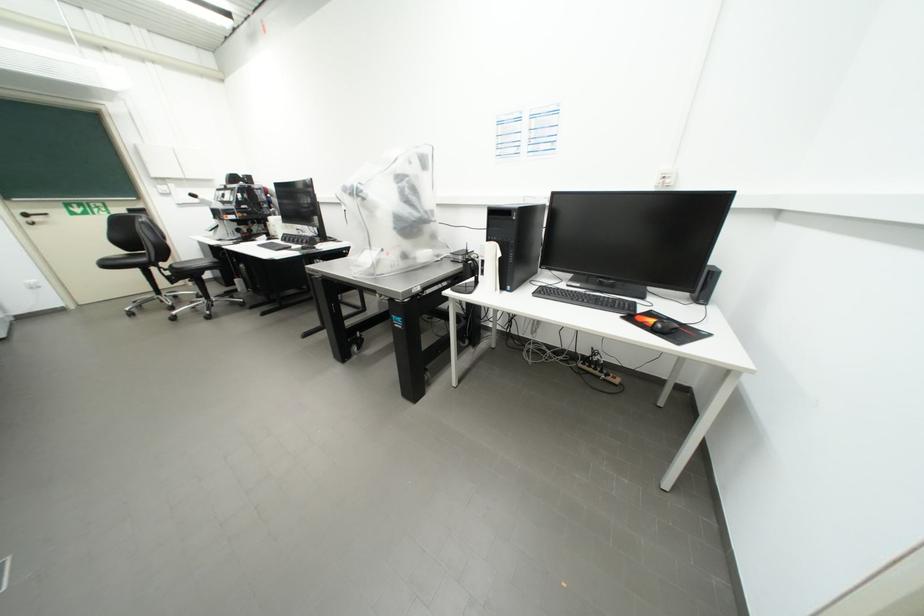
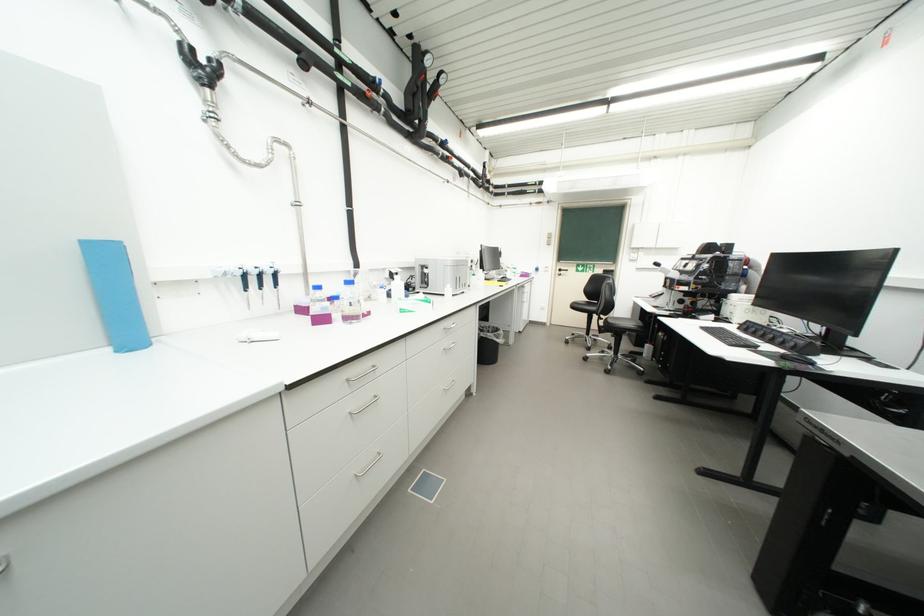
Question: The camera is either moving clockwise (left) or counter-clockwise (right) around the object. The first image is from the beginning of the video and the second image is from the end. Is the camera moving left or right when shooting the video?

Choices:
 (A) Left
 (B) Right

Answer: (B)